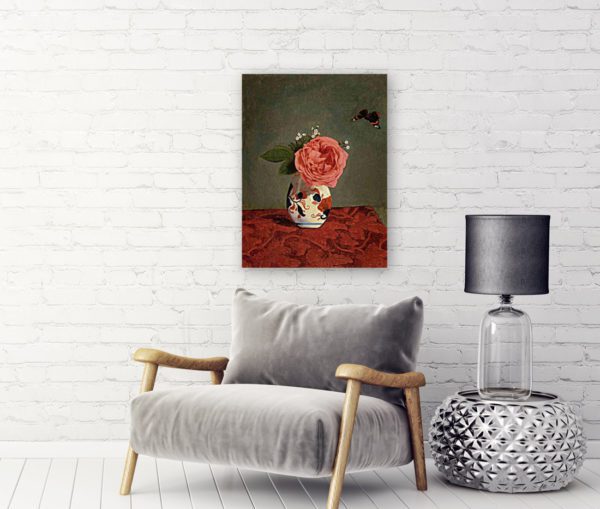
Where is `clear glass lamp base`? This screenshot has height=509, width=600. clear glass lamp base is located at coordinates (509, 370).